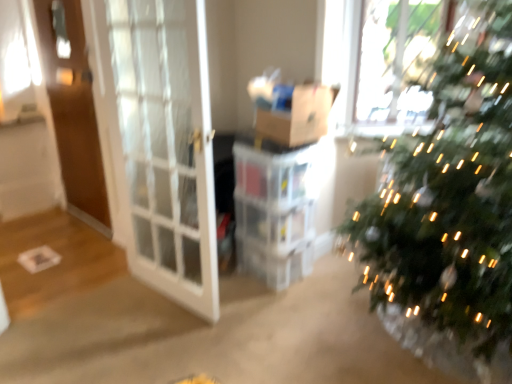
Question: Does white glass screen door at left, arranged as the first screen door when viewed from the right, contain brown wooden screen door at left, acting as the 1th screen door starting from the back?

Choices:
 (A) no
 (B) yes

Answer: (A)

Question: From a real-world perspective, is white glass screen door at left, arranged as the second screen door when viewed from the back, positioned over brown wooden screen door at left, placed as the 1th screen door when sorted from left to right, based on gravity?

Choices:
 (A) yes
 (B) no

Answer: (B)

Question: Would you say white glass screen door at left, which is the second screen door from left to right, is outside brown wooden screen door at left, placed as the 1th screen door when sorted from left to right?

Choices:
 (A) yes
 (B) no

Answer: (A)

Question: From a real-world perspective, is white glass screen door at left, arranged as the second screen door when viewed from the back, physically below brown wooden screen door at left, the 2th screen door in the right-to-left sequence?

Choices:
 (A) no
 (B) yes

Answer: (B)

Question: Is white glass screen door at left, arranged as the first screen door when viewed from the right, closer to camera compared to brown wooden screen door at left, acting as the 2th screen door starting from the front?

Choices:
 (A) no
 (B) yes

Answer: (B)

Question: From the image's perspective, is white glass screen door at left, which appears as the first screen door when viewed from the front, beneath brown wooden screen door at left, the 2th screen door in the right-to-left sequence?

Choices:
 (A) no
 (B) yes

Answer: (B)

Question: Would you say brown wooden screen door at left, acting as the 2th screen door starting from the front, is outside white glass screen door at left, which appears as the first screen door when viewed from the front?

Choices:
 (A) no
 (B) yes

Answer: (B)

Question: From the image's perspective, is brown wooden screen door at left, placed as the 1th screen door when sorted from left to right, above white glass screen door at left, which appears as the first screen door when viewed from the front?

Choices:
 (A) yes
 (B) no

Answer: (A)

Question: Is brown wooden screen door at left, placed as the 1th screen door when sorted from left to right, positioned behind white glass screen door at left, which is the second screen door from left to right?

Choices:
 (A) yes
 (B) no

Answer: (A)

Question: Does brown wooden screen door at left, acting as the 1th screen door starting from the back, turn towards white glass screen door at left, arranged as the second screen door when viewed from the back?

Choices:
 (A) no
 (B) yes

Answer: (A)

Question: Is brown wooden screen door at left, acting as the 2th screen door starting from the front, next to white glass screen door at left, which appears as the first screen door when viewed from the front, and touching it?

Choices:
 (A) yes
 (B) no

Answer: (B)

Question: Considering the relative sizes of brown wooden screen door at left, acting as the 2th screen door starting from the front, and white glass screen door at left, which appears as the first screen door when viewed from the front, in the image provided, is brown wooden screen door at left, acting as the 2th screen door starting from the front, shorter than white glass screen door at left, which appears as the first screen door when viewed from the front,?

Choices:
 (A) no
 (B) yes

Answer: (A)

Question: Could you tell me if white glass screen door at left, which appears as the first screen door when viewed from the front, is facing brown cardboard box at center?

Choices:
 (A) no
 (B) yes

Answer: (B)